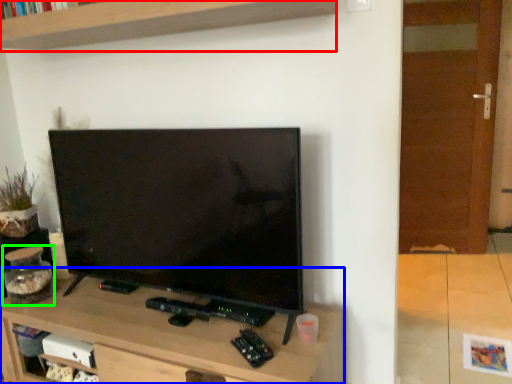
Question: Which object is the farthest from shelf (highlighted by a red box)? Choose among these: table (highlighted by a blue box) or glass jar (highlighted by a green box).

Choices:
 (A) table
 (B) glass jar

Answer: (A)